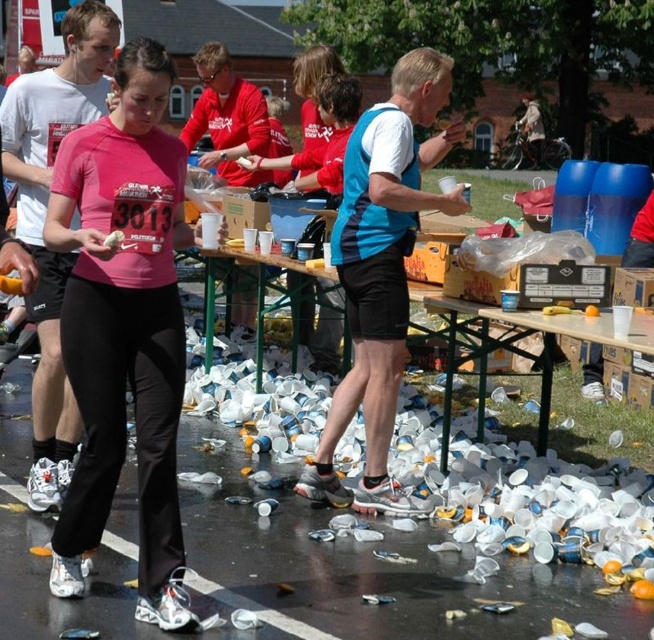
You are a runner in the marathon and you see the white plastic table at center and the white plastic cup at center. Which object is closer to the ground?

The white plastic cup at center is closer to the ground because the white plastic table at center is positioned under it.

You are a photographer positioned at the starting line of the marathon. You want to take a photo that includes both the woman holding the pink athletic top with number 3013 and the scattered white plastic cups. Which of the two points, point (x=283, y=305) or point (x=109, y=237), is closer to the camera so you can ensure proper focus?

Point (x=283, y=305) is closer to the camera than point (x=109, y=237), so you should focus on that point to ensure both the woman and the cups are in focus.